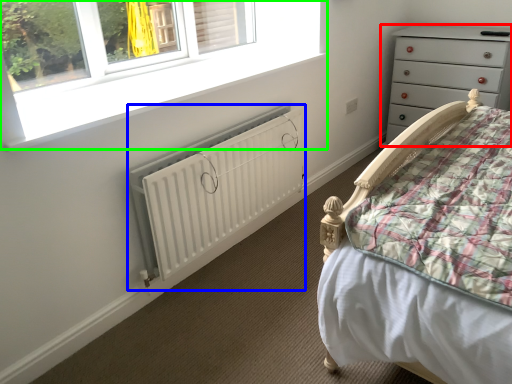
Question: Which is farther away from chest of drawers (highlighted by a red box)? radiator (highlighted by a blue box) or window (highlighted by a green box)?

Choices:
 (A) radiator
 (B) window

Answer: (A)